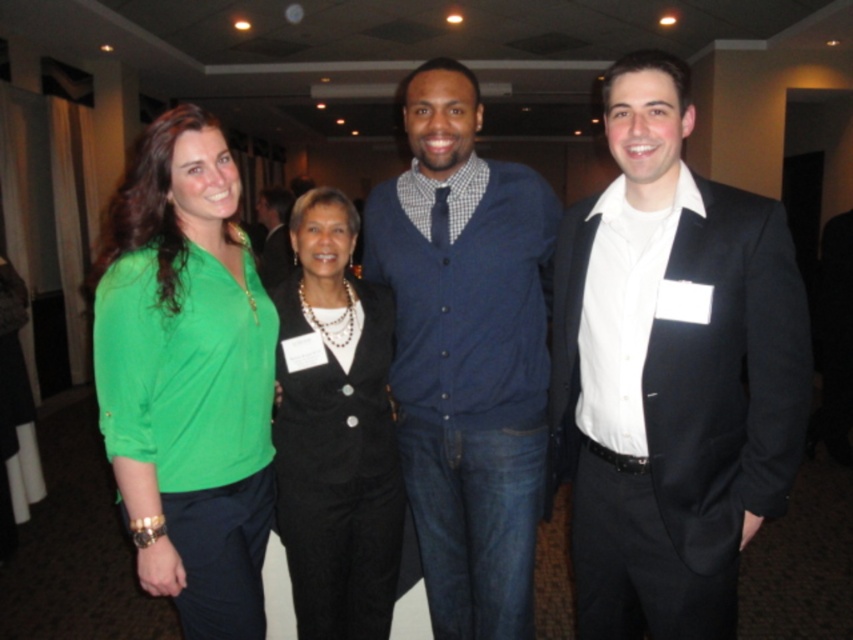
You are organizing a photo shoot and need to arrange the models in the order they appear from left to right. Based on the scene description, which model is positioned to the left of the other between the green fabric blouse at left and the black textured suit at center?

The green fabric blouse at left is positioned to the left of the black textured suit at center.

Consider the image. You are standing in the room and want to locate the green fabric blouse at left. According to the coordinates provided, where should you look?

The green fabric blouse at left is located at point 0.589 on the x axis and 0.220 on the y axis.

You are a photographer adjusting the lighting for a group photo. You notice the green fabric blouse at left and the black textured suit at center. Which clothing item is blocking the light from reaching the other?

The green fabric blouse at left is positioned over the black textured suit at center, so it is blocking the light from reaching the black textured suit at center.